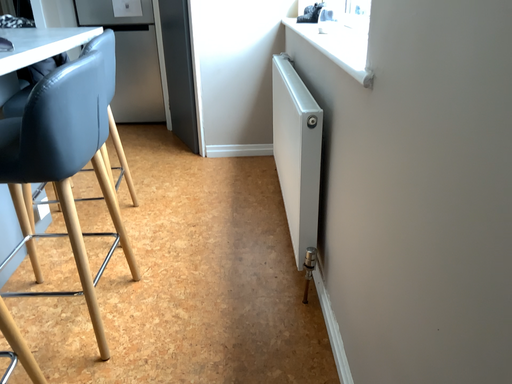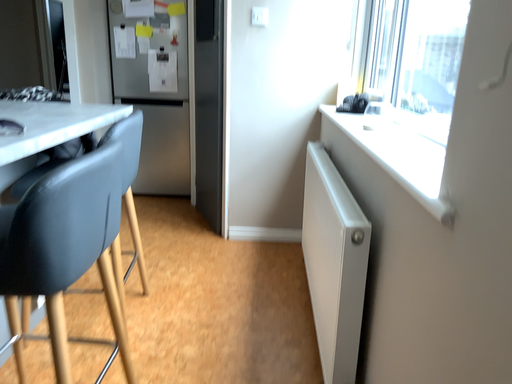
Question: How did the camera likely rotate when shooting the video?

Choices:
 (A) rotated upward
 (B) rotated downward

Answer: (A)